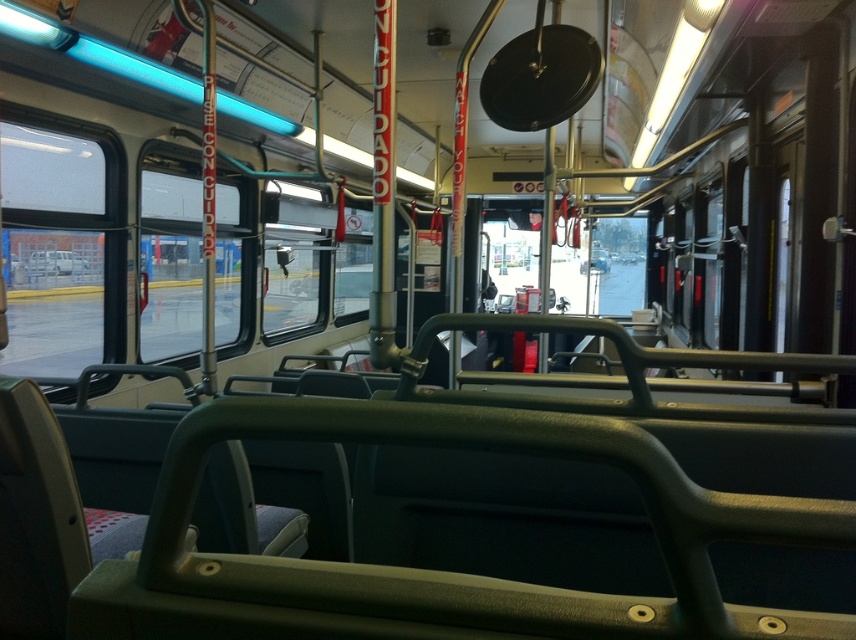
Question: Is transparent glass window at left to the right of transparent glass window at center from the viewer's perspective?

Choices:
 (A) yes
 (B) no

Answer: (B)

Question: Is transparent glass window at left to the right of transparent glass window at center from the viewer's perspective?

Choices:
 (A) yes
 (B) no

Answer: (B)

Question: Does transparent glass window at left have a larger size compared to transparent glass window at center?

Choices:
 (A) no
 (B) yes

Answer: (B)

Question: Which object is farther from the camera taking this photo?

Choices:
 (A) transparent glass window at center
 (B) transparent glass window at left

Answer: (A)

Question: Among these points, which one is nearest to the camera?

Choices:
 (A) (162, 280)
 (B) (75, 330)

Answer: (B)